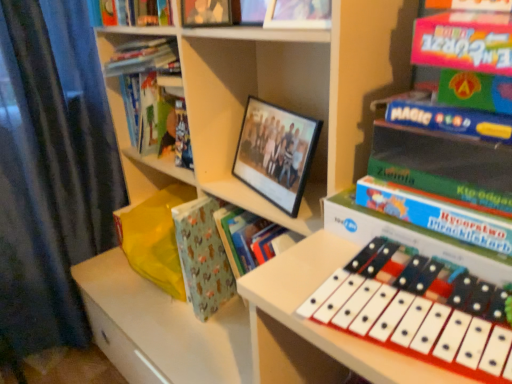
Question: Is matte plastic photo frame at upper center, positioned as the 2th book in right-to-left order, taller or shorter than matte black photo frame at upper center, which ranks as the 2th book in back-to-front order?

Choices:
 (A) tall
 (B) short

Answer: (B)

Question: Does point (327, 3) appear closer or farther from the camera than point (186, 11)?

Choices:
 (A) closer
 (B) farther

Answer: (A)

Question: Which object is the closest to the green matte book at right, marked as the 1th book in a front-to-back arrangement?

Choices:
 (A) matte black photo frame at upper center, which appears as the third book when viewed from the front
 (B) hardcover book at upper left, the 1th book from the back
 (C) white plastic musical keyboard at lower right
 (D) black matte picture frame at center
 (E) matte plastic photo frame at upper center, placed as the 2th book when sorted from front to back

Answer: (E)

Question: Which is farther from the white plastic musical keyboard at lower right?

Choices:
 (A) matte black photo frame at upper center, the second book in the left-to-right sequence
 (B) green matte book at right, marked as the 1th book in a front-to-back arrangement
 (C) patterned paper at center
 (D) matte plastic photo frame at upper center, placed as the 2th book when sorted from front to back
 (E) hardcover book at upper left, the 4th book from the right

Answer: (E)